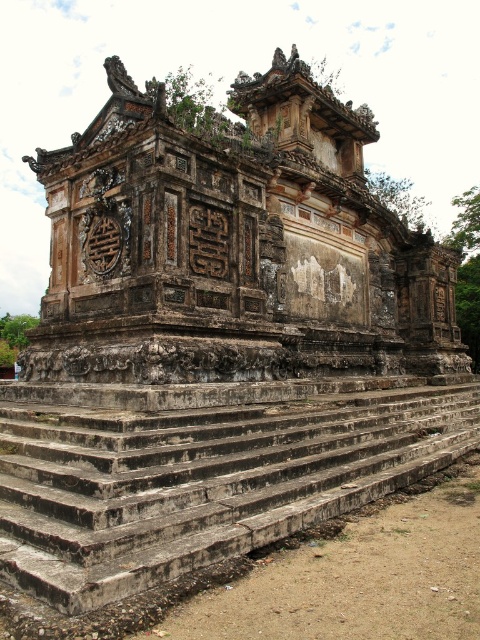
You are a tour guide explaining the layout of the site to visitors. You mention the weathered stone structure at center and the weathered stone stairs at center. Which one has a greater width?

The weathered stone structure at center might be wider than weathered stone stairs at center according to the description.

You are a tourist standing at the base of the ancient stone structure. You notice a specific point marked at coordinates (233, 246). Based on the scene description, what significant feature does this point likely indicate?

The point at coordinates (233, 246) marks the weathered stone structure at center, which is the central part of the structure displaying symmetrical designs, including circular motifs and geometric patterns, indicative of traditional craftsmanship.